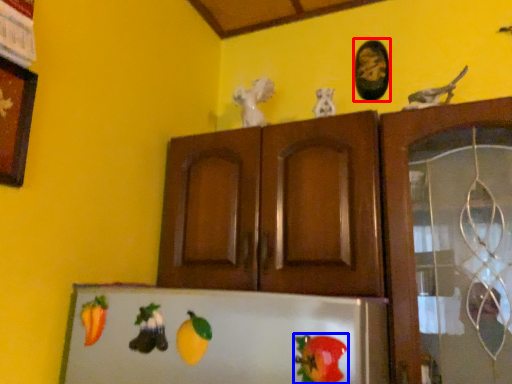
Question: Which of the following is the farthest to the observer, picture frame (highlighted by a red box) or vegetable (highlighted by a blue box)?

Choices:
 (A) picture frame
 (B) vegetable

Answer: (A)